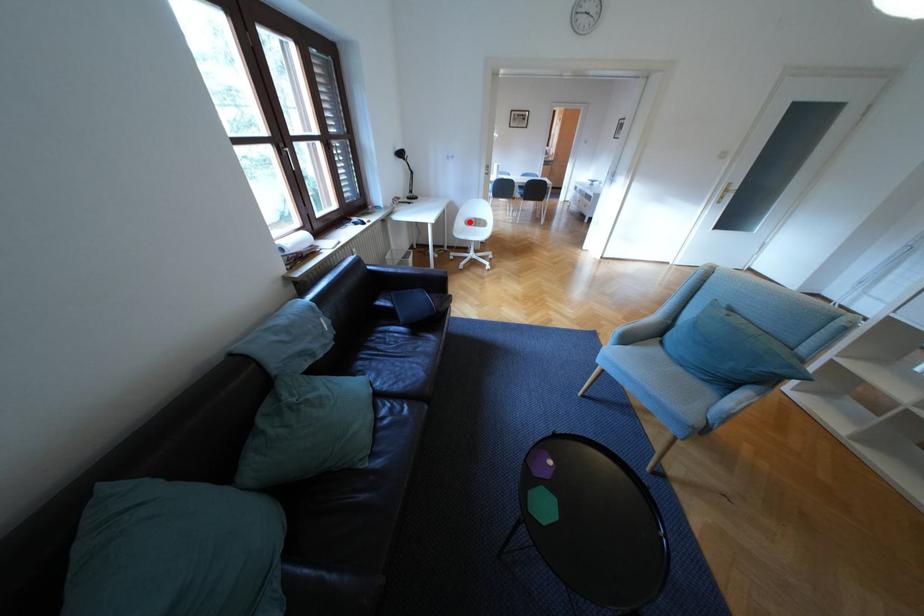
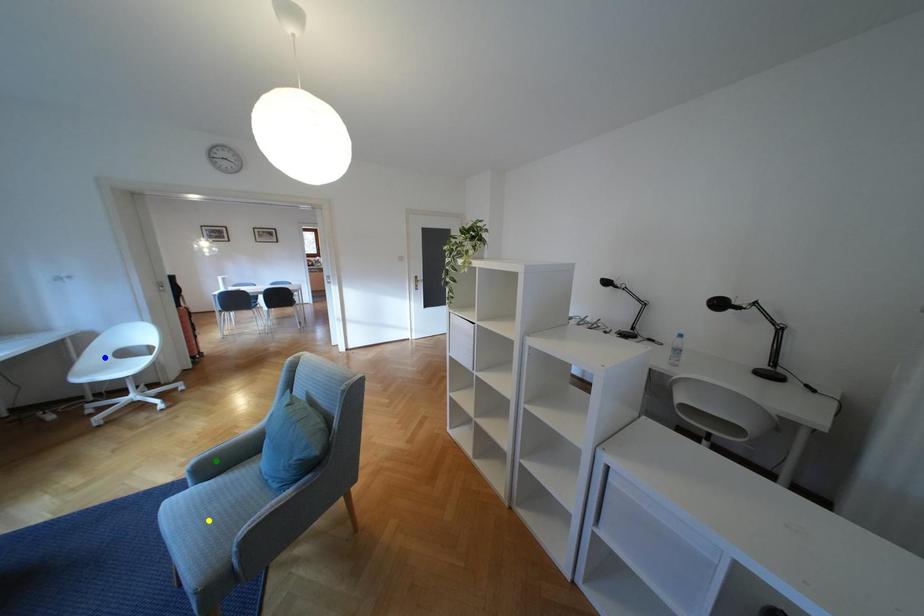
Question: I am providing you with two images of the same scene from different viewpoints. A red point is marked on the first image. You are given multiple points on the second image. Which point in image 2 represents the same 3d spot as the red point in image 1?

Choices:
 (A) blue point
 (B) yellow point
 (C) green point

Answer: (A)